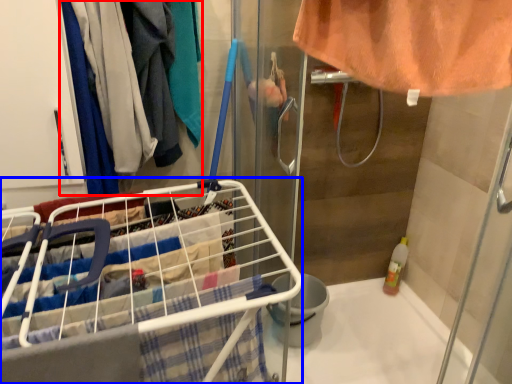
Question: Which object appears farthest to the camera in this image, clothing (highlighted by a red box) or shopping cart (highlighted by a blue box)?

Choices:
 (A) clothing
 (B) shopping cart

Answer: (A)